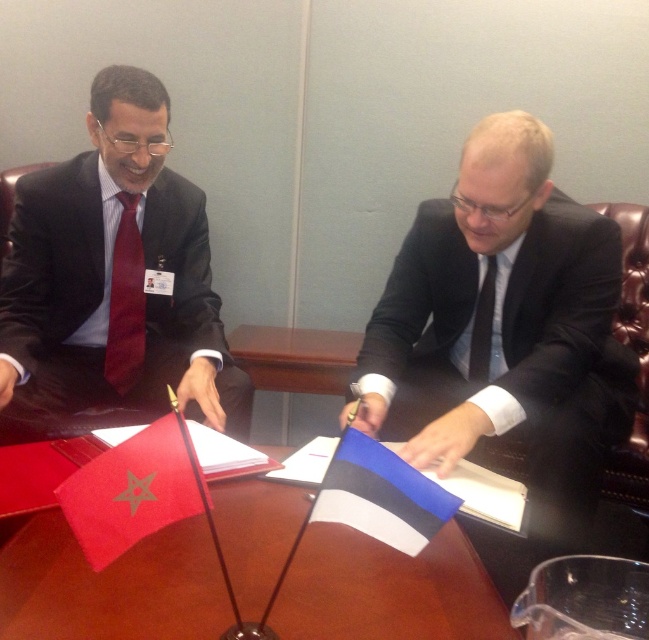
Question: Which object is farther from the camera taking this photo?

Choices:
 (A) red fabric flag at center
 (B) matte black suit at left
 (C) wooden round table at center

Answer: (B)

Question: Which object appears closest to the camera in this image?

Choices:
 (A) matte red tie at left
 (B) wooden round table at center
 (C) matte black suit at left

Answer: (B)

Question: Does matte black suit at left appear on the left side of matte red tie at left?

Choices:
 (A) yes
 (B) no

Answer: (B)

Question: Is matte black suit at center bigger than black silk tie at right?

Choices:
 (A) no
 (B) yes

Answer: (B)

Question: Which point is farther from the camera taking this photo?

Choices:
 (A) (487, 301)
 (B) (169, 481)

Answer: (A)

Question: Is blue and white striped flag at center wider than matte red tie at left?

Choices:
 (A) yes
 (B) no

Answer: (A)